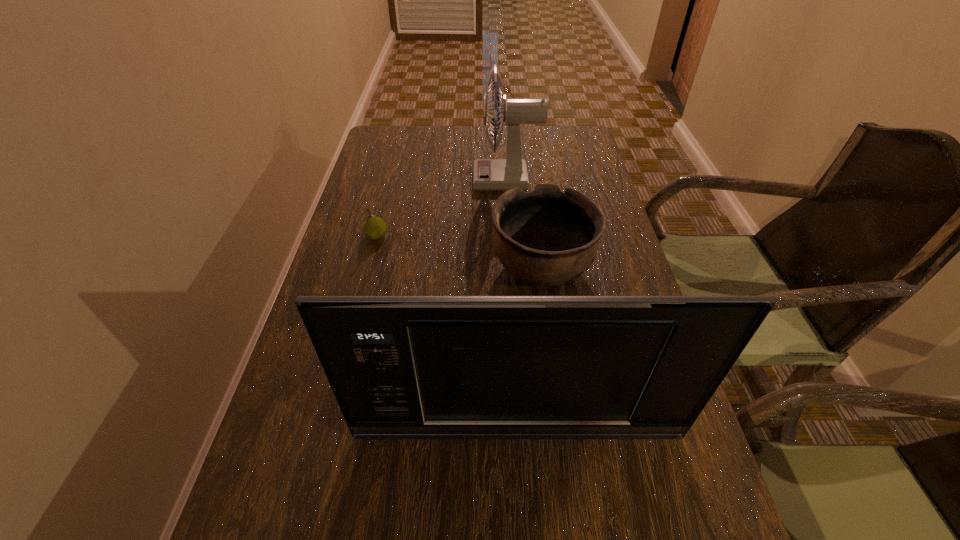
This screenshot has width=960, height=540. In the image, there is a desktop. Identify the location of free space at the far right corner. (559, 130).

This screenshot has width=960, height=540. I want to click on empty space that is in between the farthest object and the leftmost object, so click(442, 208).

The height and width of the screenshot is (540, 960). In order to click on the third closest object to the leftmost object in this screenshot , I will do `click(401, 367)`.

Locate which object ranks third in proximity to the farthest object. Please provide its 2D coordinates. Your answer should be formatted as a tuple, i.e. [(x, y)], where the tuple contains the x and y coordinates of a point satisfying the conditions above.

[(401, 367)]

Find the location of a particular element. The width and height of the screenshot is (960, 540). vacant space that satisfies the following two spatial constraints: 1. on the front-facing side of the fan; 2. on the left side of the second shortest object is located at coordinates (513, 269).

This screenshot has width=960, height=540. Identify the location of free spot that satisfies the following two spatial constraints: 1. on the front side of the pottery; 2. on the left side of the leftmost object. (368, 269).

Identify the location of vacant space that satisfies the following two spatial constraints: 1. on the front-facing side of the fan; 2. on the front panel of the microwave oven. This screenshot has width=960, height=540. click(x=525, y=434).

Find the location of `vacant space that satisfies the following two spatial constraints: 1. on the back side of the third tallest object; 2. on the front-facing side of the farthest object`. vacant space that satisfies the following two spatial constraints: 1. on the back side of the third tallest object; 2. on the front-facing side of the farthest object is located at coordinates (529, 180).